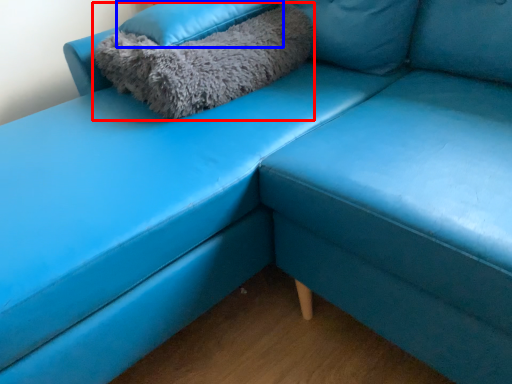
Question: Which object appears closest to the camera in this image, pillow (highlighted by a red box) or pillow (highlighted by a blue box)?

Choices:
 (A) pillow
 (B) pillow

Answer: (A)